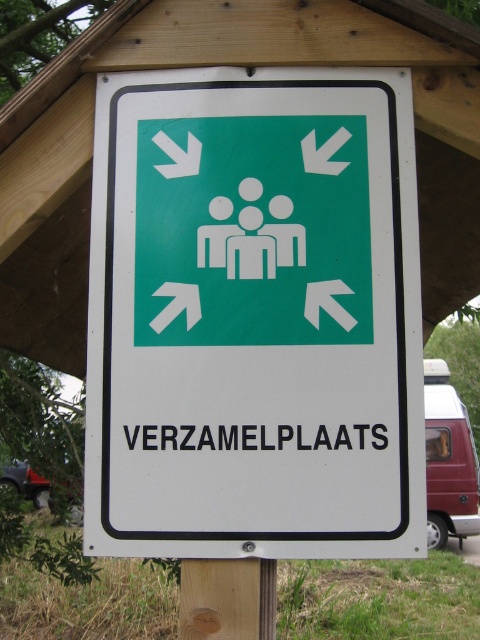
How distant is green plastic sign at center from wooden post at center?

50.54 centimeters

Which is behind, point (266, 426) or point (201, 624)?

The point (266, 426) is more distant.

Image resolution: width=480 pixels, height=640 pixels. I want to click on green plastic sign at center, so click(254, 316).